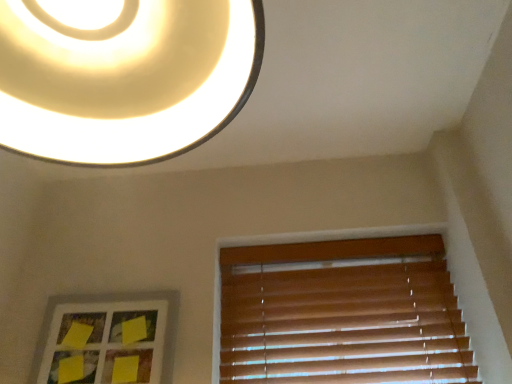
Question: From the image's perspective, does yellow paper at lower left appear higher than matte white lampshade at upper center?

Choices:
 (A) yes
 (B) no

Answer: (B)

Question: Is matte white lampshade at upper center completely or partially inside yellow paper at lower left?

Choices:
 (A) no
 (B) yes

Answer: (A)

Question: Considering the relative sizes of yellow paper at lower left and matte white lampshade at upper center in the image provided, is yellow paper at lower left smaller than matte white lampshade at upper center?

Choices:
 (A) yes
 (B) no

Answer: (A)

Question: Considering the relative sizes of yellow paper at lower left and matte white lampshade at upper center in the image provided, is yellow paper at lower left shorter than matte white lampshade at upper center?

Choices:
 (A) yes
 (B) no

Answer: (A)

Question: Can you confirm if yellow paper at lower left is taller than matte white lampshade at upper center?

Choices:
 (A) no
 (B) yes

Answer: (A)

Question: Relative to wooden blinds at lower right, is yellow paper at lower left in front or behind?

Choices:
 (A) front
 (B) behind

Answer: (A)

Question: Choose the correct answer: Is yellow paper at lower left inside wooden blinds at lower right or outside it?

Choices:
 (A) outside
 (B) inside

Answer: (A)

Question: Considering the positions of yellow paper at lower left and wooden blinds at lower right in the image, is yellow paper at lower left taller or shorter than wooden blinds at lower right?

Choices:
 (A) tall
 (B) short

Answer: (B)

Question: Is point (159, 359) positioned closer to the camera than point (309, 278)?

Choices:
 (A) closer
 (B) farther

Answer: (A)

Question: From the image's perspective, relative to yellow paper at lower left, is wooden blinds at lower right above or below?

Choices:
 (A) below
 (B) above

Answer: (B)

Question: Relative to yellow paper at lower left, is wooden blinds at lower right in front or behind?

Choices:
 (A) behind
 (B) front

Answer: (A)

Question: Is wooden blinds at lower right inside or outside of yellow paper at lower left?

Choices:
 (A) inside
 (B) outside

Answer: (B)

Question: Looking at the image, does wooden blinds at lower right seem bigger or smaller compared to yellow paper at lower left?

Choices:
 (A) small
 (B) big

Answer: (B)

Question: Considering the relative positions of wooden blinds at lower right and matte white lampshade at upper center in the image provided, is wooden blinds at lower right to the left or to the right of matte white lampshade at upper center?

Choices:
 (A) left
 (B) right

Answer: (B)

Question: Is wooden blinds at lower right taller or shorter than matte white lampshade at upper center?

Choices:
 (A) tall
 (B) short

Answer: (A)